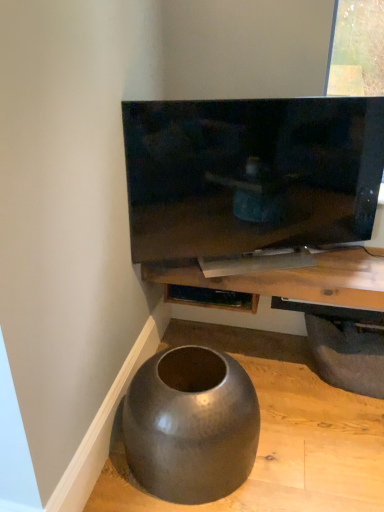
Find the location of `wooden shelf at center`. wooden shelf at center is located at coordinates (293, 279).

Where is `dark gray rubber tire at lower right`? Image resolution: width=384 pixels, height=512 pixels. dark gray rubber tire at lower right is located at coordinates (347, 355).

The width and height of the screenshot is (384, 512). What are the coordinates of `matte black shelf at lower center` in the screenshot? It's located at (211, 298).

What do you see at coordinates (276, 433) in the screenshot?
I see `matte gray concrete at lower left` at bounding box center [276, 433].

At what (x,y) coordinates should I click in order to perform the action: click on wooden shelf at center. Please return your answer as a coordinate pair (x, y). This screenshot has width=384, height=512. Looking at the image, I should click on (293, 279).

From the image's perspective, is dark gray rubber tire at lower right located beneath wooden shelf at center?

Correct, dark gray rubber tire at lower right appears lower than wooden shelf at center in the image.

Considering the relative sizes of dark gray rubber tire at lower right and wooden shelf at center in the image provided, is dark gray rubber tire at lower right wider than wooden shelf at center?

No, dark gray rubber tire at lower right is not wider than wooden shelf at center.

Which is less distant, (356, 388) or (377, 261)?

The point (377, 261) is more forward.

What's the angular difference between dark gray rubber tire at lower right and matte black shelf at lower center's facing directions?

1.63 degrees separate the facing orientations of dark gray rubber tire at lower right and matte black shelf at lower center.

Is dark gray rubber tire at lower right facing away from matte black shelf at lower center?

No, dark gray rubber tire at lower right is not facing the opposite direction of matte black shelf at lower center.

From the image's perspective, is dark gray rubber tire at lower right under matte black shelf at lower center?

Correct, dark gray rubber tire at lower right appears lower than matte black shelf at lower center in the image.

Where is `shelf behind the dark gray rubber tire at lower right`? The width and height of the screenshot is (384, 512). shelf behind the dark gray rubber tire at lower right is located at coordinates (211, 298).

Considering the relative sizes of matte black tv at upper center and matte black shelf at lower center in the image provided, is matte black tv at upper center smaller than matte black shelf at lower center?

No.

From the image's perspective, who appears lower, matte black tv at upper center or matte black shelf at lower center?

From the image's view, matte black shelf at lower center is below.

Which is less distant, (174,208) or (235,292)?

Point (174,208) is closer to the camera than point (235,292).

Which of these two, matte black tv at upper center or dark gray rubber tire at lower right, stands taller?

Standing taller between the two is matte black tv at upper center.

Considering the relative sizes of matte black tv at upper center and dark gray rubber tire at lower right in the image provided, is matte black tv at upper center wider than dark gray rubber tire at lower right?

Incorrect, the width of matte black tv at upper center does not surpass that of dark gray rubber tire at lower right.

Which is in front, point (302, 354) or point (362, 262)?

The point (362, 262) is closer.

Which object is wider, matte gray concrete at lower left or wooden shelf at center?

With larger width is matte gray concrete at lower left.

How different are the orientations of matte gray concrete at lower left and wooden shelf at center in degrees?

1.01 degrees.

Can you confirm if dark gray rubber tire at lower right is wider than matte gray concrete at lower left?

Incorrect, the width of dark gray rubber tire at lower right does not surpass that of matte gray concrete at lower left.

How different are the orientations of dark gray rubber tire at lower right and matte gray concrete at lower left in degrees?

The facing directions of dark gray rubber tire at lower right and matte gray concrete at lower left are 0.744 degrees apart.

Is the surface of dark gray rubber tire at lower right in direct contact with matte gray concrete at lower left?

dark gray rubber tire at lower right and matte gray concrete at lower left are not in contact.

Where is `concrete to the left of dark gray rubber tire at lower right`? concrete to the left of dark gray rubber tire at lower right is located at coordinates (276, 433).

Is wooden shelf at center directly adjacent to matte black shelf at lower center?

No, wooden shelf at center is not with matte black shelf at lower center.

Which is in front, wooden shelf at center or matte black shelf at lower center?

wooden shelf at center is in front.

Considering the points (163, 270) and (201, 291), which point is behind, point (163, 270) or point (201, 291)?

Point (201, 291)

Can matte black shelf at lower center be found inside wooden shelf at center?

Absolutely, matte black shelf at lower center is inside wooden shelf at center.

The image size is (384, 512). What are the coordinates of `table in front of the dark gray rubber tire at lower right` in the screenshot? It's located at (293, 279).

Identify the location of shelf that appears above the dark gray rubber tire at lower right (from a real-world perspective). The width and height of the screenshot is (384, 512). (211, 298).

Estimate the real-world distances between objects in this image. Which object is closer to dark gray rubber tire at lower right, matte black tv at upper center or wooden shelf at center?

wooden shelf at center.

Estimate the real-world distances between objects in this image. Which object is closer to matte gray concrete at lower left, matte black shelf at lower center or dark gray rubber tire at lower right?

Among the two, dark gray rubber tire at lower right is located nearer to matte gray concrete at lower left.

Estimate the real-world distances between objects in this image. Which object is further from wooden shelf at center, matte black shelf at lower center or matte black tv at upper center?

Based on the image, matte black tv at upper center appears to be further to wooden shelf at center.

Estimate the real-world distances between objects in this image. Which object is closer to matte gray concrete at lower left, matte black tv at upper center or wooden shelf at center?

wooden shelf at center is closer to matte gray concrete at lower left.

Based on their spatial positions, is wooden shelf at center or matte black shelf at lower center further from dark gray rubber tire at lower right?

matte black shelf at lower center is positioned further to the anchor dark gray rubber tire at lower right.

From the image, which object appears to be farther from wooden shelf at center, matte gray concrete at lower left or matte black shelf at lower center?

The object further to wooden shelf at center is matte gray concrete at lower left.

Consider the image. Which object lies further to the anchor point matte black shelf at lower center, matte black tv at upper center or wooden shelf at center?

matte black tv at upper center.

Considering their positions, is wooden shelf at center positioned further to matte black shelf at lower center than dark gray rubber tire at lower right?

dark gray rubber tire at lower right is further to matte black shelf at lower center.

Identify the location of shelf between matte black tv at upper center and dark gray rubber tire at lower right vertically. click(x=211, y=298).

This screenshot has width=384, height=512. I want to click on table between matte black tv at upper center and dark gray rubber tire at lower right in the up-down direction, so click(x=293, y=279).

Find the location of a particular element. tire between matte black tv at upper center and matte gray concrete at lower left from top to bottom is located at coordinates [347, 355].

The image size is (384, 512). Find the location of `shelf that lies between matte black tv at upper center and matte gray concrete at lower left from top to bottom`. shelf that lies between matte black tv at upper center and matte gray concrete at lower left from top to bottom is located at coordinates (211, 298).